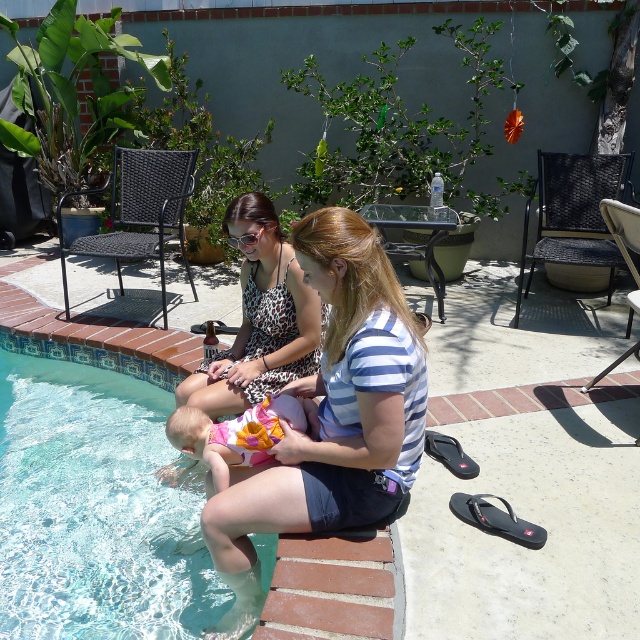
You are a lifeguard on duty and need to determine if the clear glass water at lower left is higher or lower than the floral swimsuit at poolside. Based on the scene, what is your observation?

The clear glass water at lower left is much taller than the floral swimsuit at poolside according to the description.

You are planning to place a small potted plant between the clear glass water at lower left and the floral swimsuit at poolside. Which object should the plant be closer to if you want it to be closer to the wider object?

The clear glass water at lower left is wider than the floral swimsuit at poolside. Therefore, the plant should be placed closer to the clear glass water at lower left to be near the wider object.